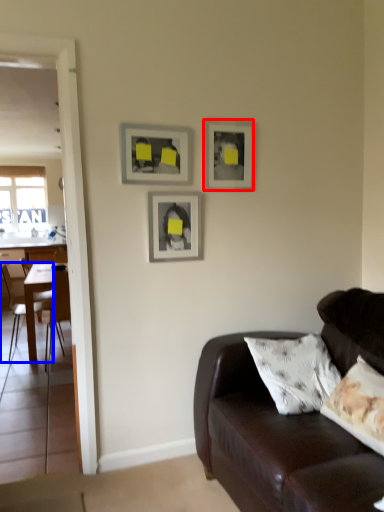
Question: Which object appears farthest to the camera in this image, picture frame (highlighted by a red box) or chair (highlighted by a blue box)?

Choices:
 (A) picture frame
 (B) chair

Answer: (B)